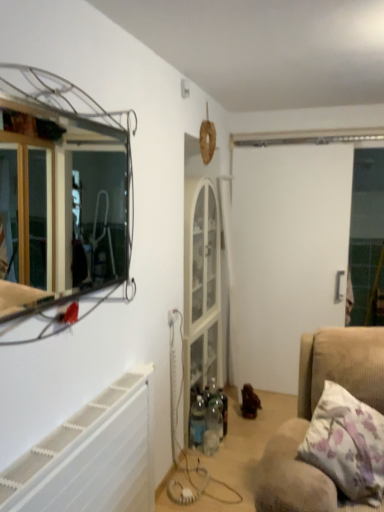
Question: Considering their positions, is metallic wire frame mirror at upper left located in front of or behind white matte screen door at center?

Choices:
 (A) behind
 (B) front

Answer: (B)

Question: Is metallic wire frame mirror at upper left spatially inside white matte screen door at center, or outside of it?

Choices:
 (A) outside
 (B) inside

Answer: (A)

Question: Which object is positioned closest to the brown wooden toy at center?

Choices:
 (A) metallic wire frame mirror at upper left
 (B) white matte screen door at center
 (C) floral fabric pillow at lower right
 (D) white plastic radiator at lower left

Answer: (B)

Question: Estimate the real-world distances between objects in this image. Which object is farther from the metallic wire frame mirror at upper left?

Choices:
 (A) white matte screen door at center
 (B) white plastic radiator at lower left
 (C) brown wooden toy at center
 (D) floral fabric pillow at lower right

Answer: (D)